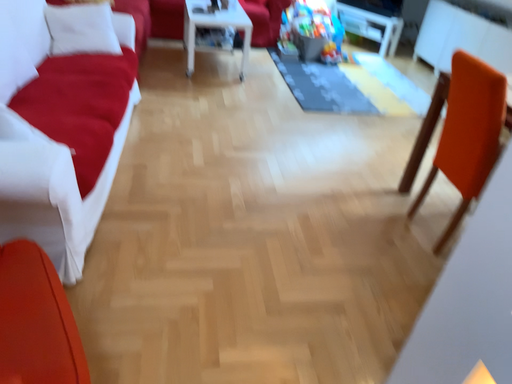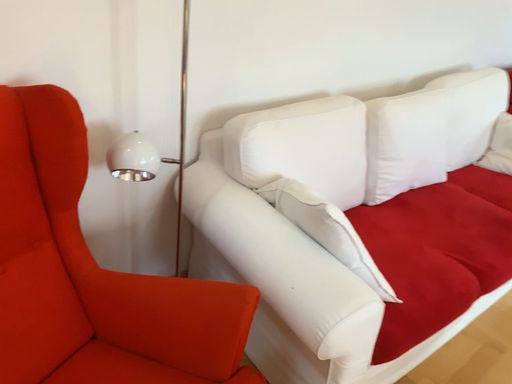
Question: Which way did the camera rotate in the video?

Choices:
 (A) rotated downward
 (B) rotated upward

Answer: (B)